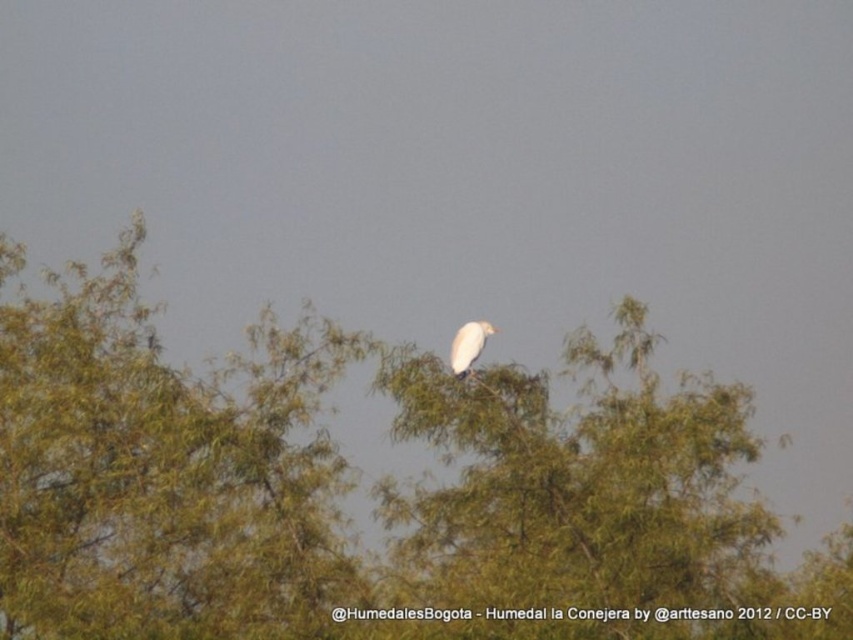
Question: Is green leafy tree at center in front of green leafy tree at upper center?

Choices:
 (A) yes
 (B) no

Answer: (A)

Question: Which point is closer to the camera?

Choices:
 (A) white matte bird at center
 (B) green leafy tree at upper center

Answer: (A)

Question: Is green leafy tree at center to the left of green leafy tree at upper center from the viewer's perspective?

Choices:
 (A) yes
 (B) no

Answer: (B)

Question: Can you confirm if green leafy tree at upper center is positioned above white matte bird at center?

Choices:
 (A) no
 (B) yes

Answer: (A)

Question: Which object appears closest to the camera in this image?

Choices:
 (A) green leafy tree at upper center
 (B) white matte bird at center

Answer: (B)

Question: Which point is farther from the camera taking this photo?

Choices:
 (A) (303, 602)
 (B) (459, 369)

Answer: (A)